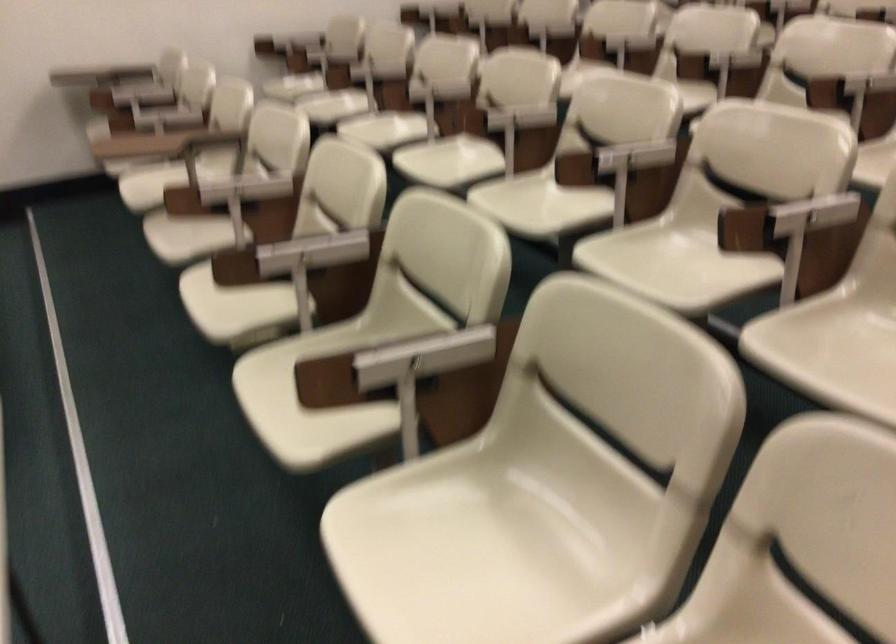
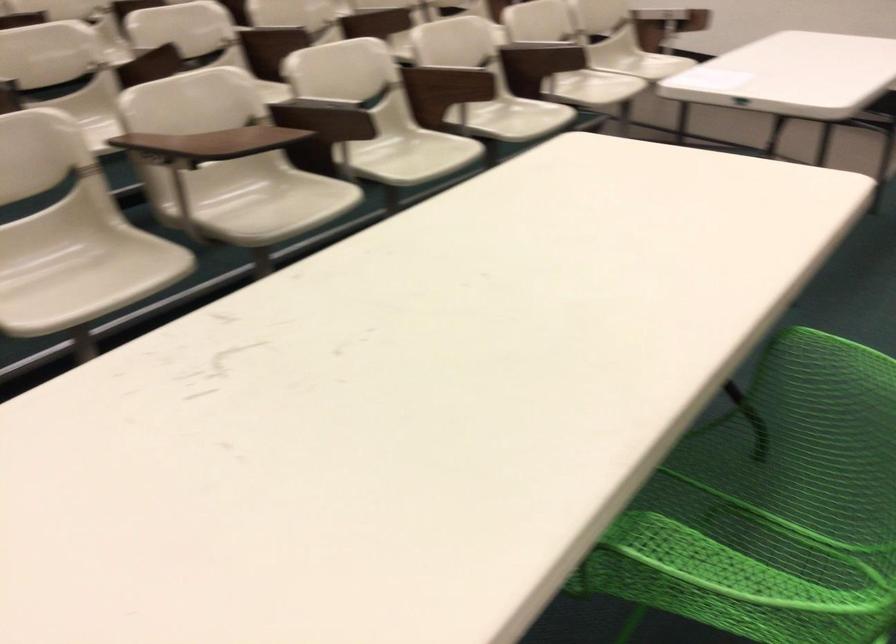
In the second image, find the point that corresponds to [247,200] in the first image.

(340, 120)